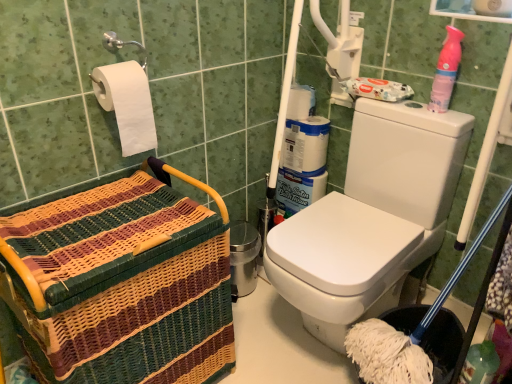
Question: Is white matte toilet paper at upper left further to the viewer compared to pink plastic spray bottle at upper right?

Choices:
 (A) no
 (B) yes

Answer: (A)

Question: Is white matte toilet paper at upper left outside of pink plastic spray bottle at upper right?

Choices:
 (A) no
 (B) yes

Answer: (B)

Question: Does white matte toilet paper at upper left turn towards pink plastic spray bottle at upper right?

Choices:
 (A) yes
 (B) no

Answer: (B)

Question: From the image's perspective, is white matte toilet paper at upper left located above pink plastic spray bottle at upper right?

Choices:
 (A) yes
 (B) no

Answer: (B)

Question: From the image's perspective, is white matte toilet paper at upper left under pink plastic spray bottle at upper right?

Choices:
 (A) yes
 (B) no

Answer: (A)

Question: In terms of size, does pink plastic spray bottle at upper right appear bigger or smaller than woven wood basket at left?

Choices:
 (A) big
 (B) small

Answer: (B)

Question: From the image's perspective, is pink plastic spray bottle at upper right above or below woven wood basket at left?

Choices:
 (A) below
 (B) above

Answer: (B)

Question: Considering the positions of point (451, 84) and point (132, 304), is point (451, 84) closer or farther from the camera than point (132, 304)?

Choices:
 (A) farther
 (B) closer

Answer: (A)

Question: From a real-world perspective, is pink plastic spray bottle at upper right physically located above or below woven wood basket at left?

Choices:
 (A) below
 (B) above

Answer: (B)

Question: Considering the positions of point (155, 127) and point (438, 99), is point (155, 127) closer or farther from the camera than point (438, 99)?

Choices:
 (A) closer
 (B) farther

Answer: (A)

Question: In terms of width, does white matte toilet paper at upper left look wider or thinner when compared to pink plastic spray bottle at upper right?

Choices:
 (A) thin
 (B) wide

Answer: (B)

Question: Is white matte toilet paper at upper left in front of or behind pink plastic spray bottle at upper right in the image?

Choices:
 (A) front
 (B) behind

Answer: (A)

Question: Is white matte toilet paper at upper left inside the boundaries of pink plastic spray bottle at upper right, or outside?

Choices:
 (A) inside
 (B) outside

Answer: (B)

Question: Considering the positions of pink plastic spray bottle at upper right and white matte toilet paper at upper left in the image, is pink plastic spray bottle at upper right bigger or smaller than white matte toilet paper at upper left?

Choices:
 (A) big
 (B) small

Answer: (B)

Question: From their relative heights in the image, would you say pink plastic spray bottle at upper right is taller or shorter than white matte toilet paper at upper left?

Choices:
 (A) tall
 (B) short

Answer: (B)